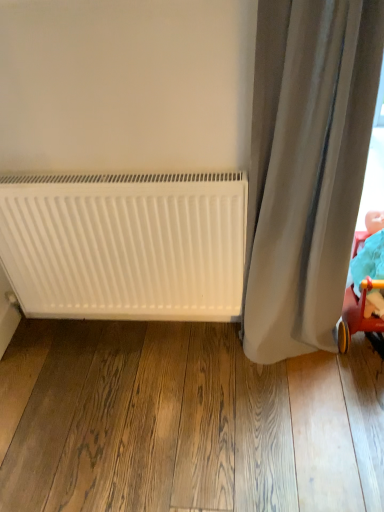
Question: Does point (344, 208) appear closer or farther from the camera than point (201, 278)?

Choices:
 (A) farther
 (B) closer

Answer: (B)

Question: Is gray fabric curtain at right bigger or smaller than white matte radiator at lower left?

Choices:
 (A) big
 (B) small

Answer: (A)

Question: Which of these objects is positioned closest to the matte red plastic baby carriage at lower right?

Choices:
 (A) white matte radiator at lower left
 (B) gray fabric curtain at right

Answer: (B)

Question: Considering the real-world distances, which object is farthest from the gray fabric curtain at right?

Choices:
 (A) matte red plastic baby carriage at lower right
 (B) white matte radiator at lower left

Answer: (B)